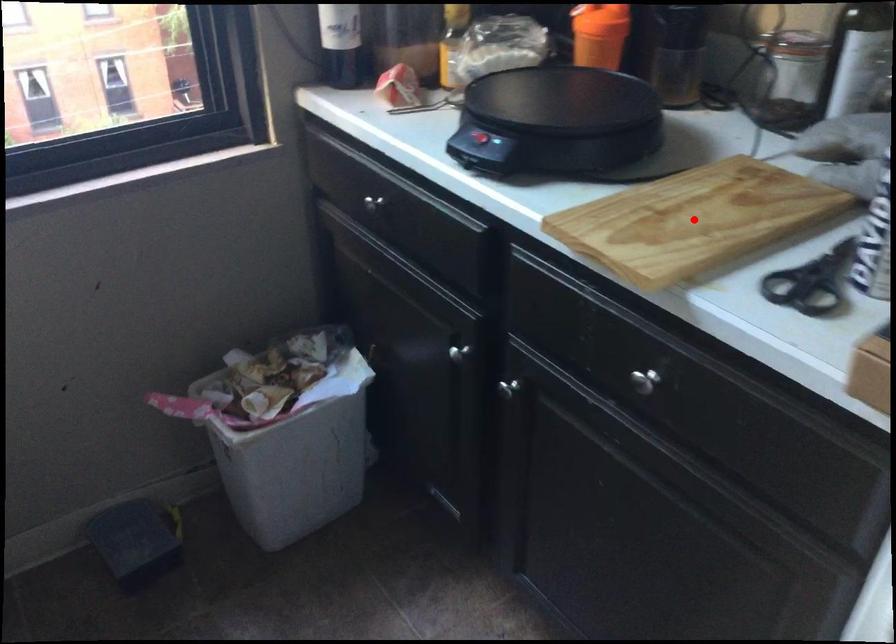
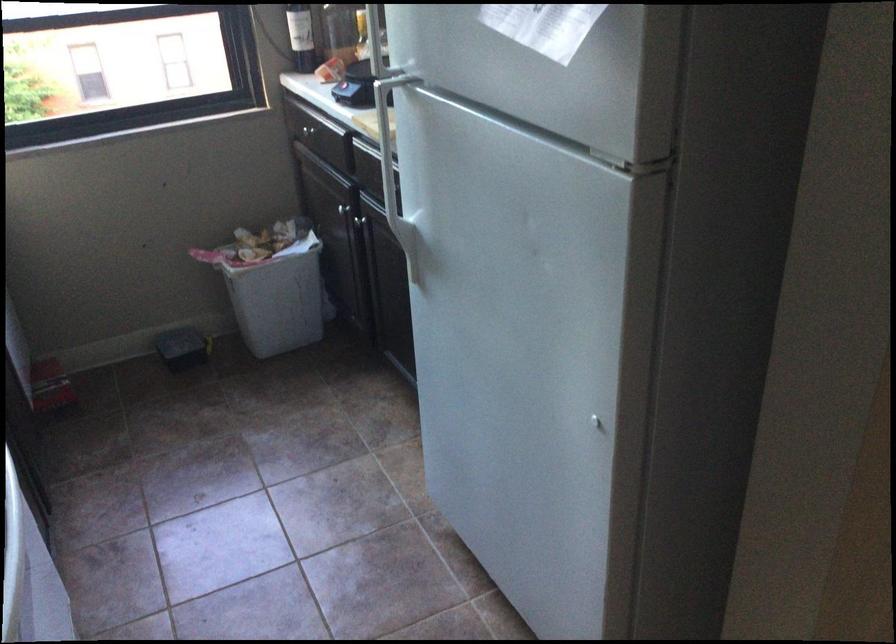
Question: I am providing you with two images of the same scene from different viewpoints. A red point is marked on the first image. At the location where the point appears in image 1, is it still visible in image 2?

Choices:
 (A) Yes
 (B) No

Answer: (B)